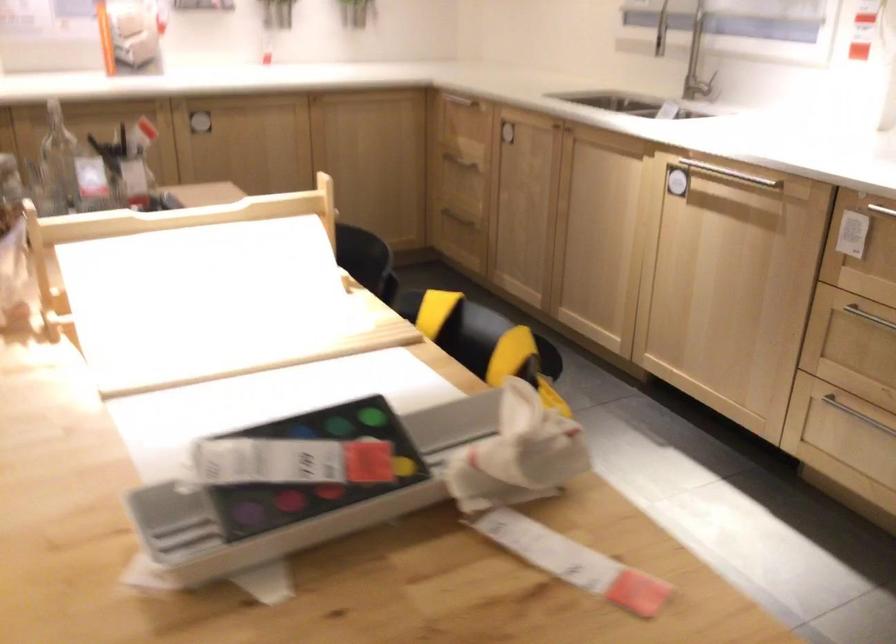
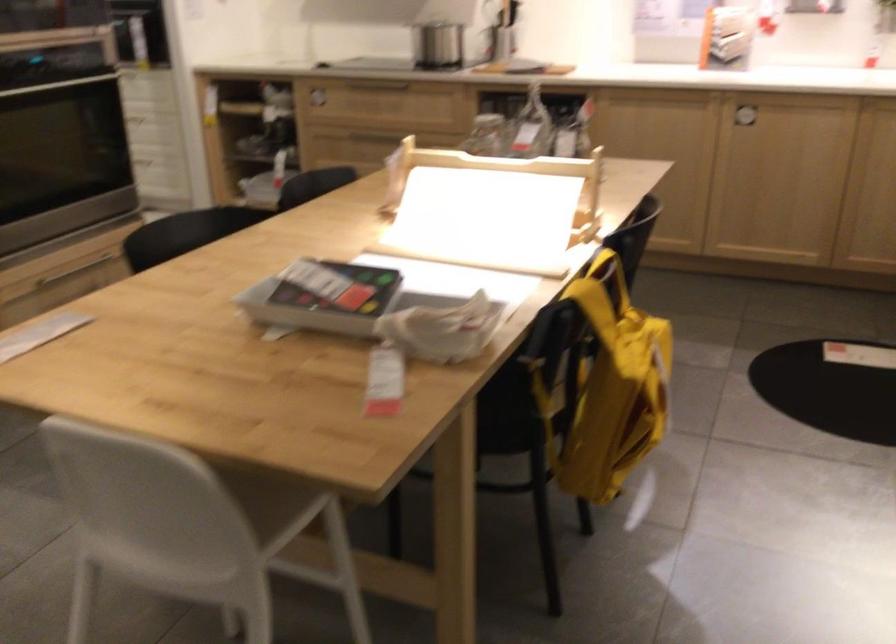
The point at (185, 243) is marked in the first image. Where is the corresponding point in the second image?

(500, 178)